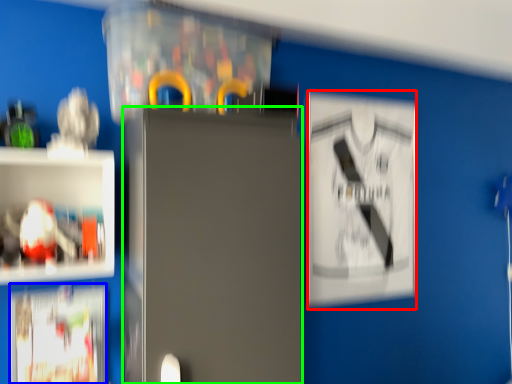
Question: Estimate the real-world distances between objects in this image. Which object is farther from poster (highlighted by a red box), poster (highlighted by a blue box) or fridge (highlighted by a green box)?

Choices:
 (A) poster
 (B) fridge

Answer: (A)